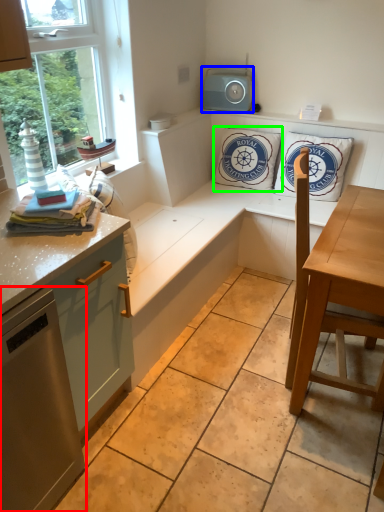
Question: Which object is positioned farthest from appliance (highlighted by a red box)? Select from speaker (highlighted by a blue box) and pillow (highlighted by a green box).

Choices:
 (A) speaker
 (B) pillow

Answer: (A)